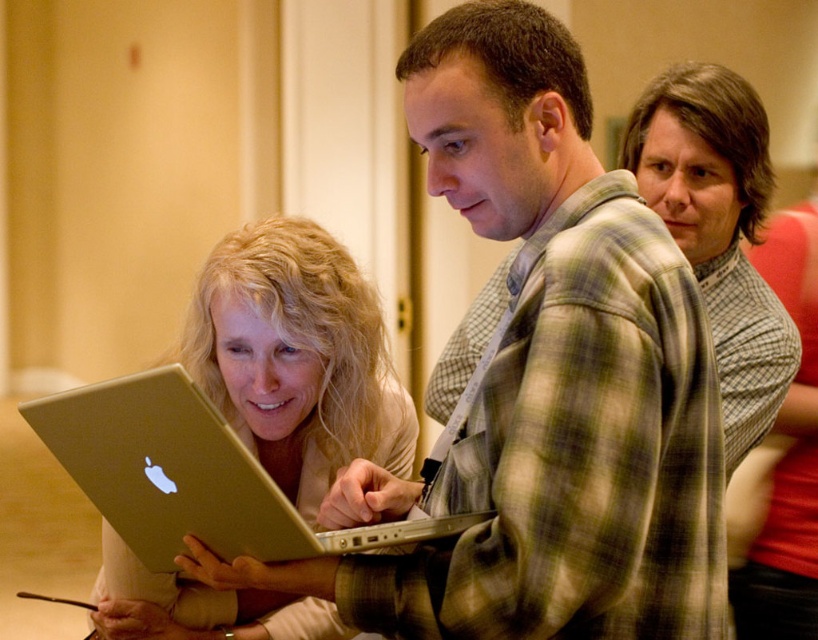
Can you confirm if matte gold laptop at center is wider than silver metallic laptop at center?

In fact, matte gold laptop at center might be narrower than silver metallic laptop at center.

Can you confirm if matte gold laptop at center is taller than silver metallic laptop at center?

Correct, matte gold laptop at center is much taller as silver metallic laptop at center.

Does point (363, 333) come closer to viewer compared to point (97, 451)?

No.

I want to click on matte gold laptop at center, so click(297, 356).